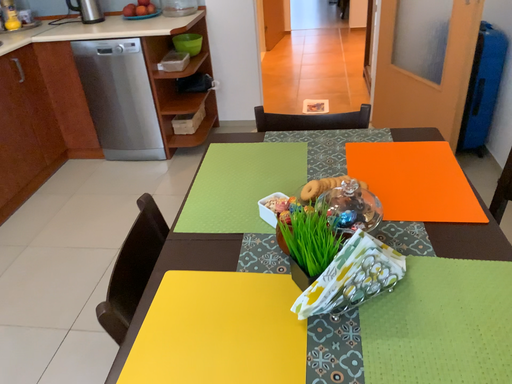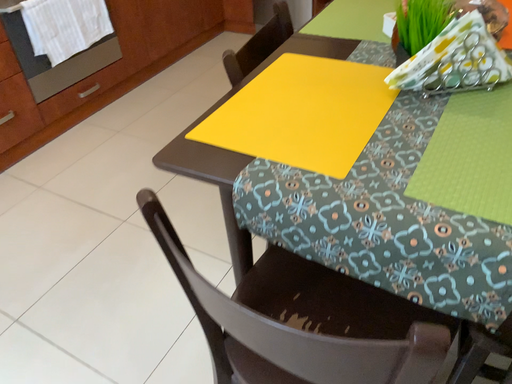
Question: How did the camera likely rotate when shooting the video?

Choices:
 (A) rotated downward
 (B) rotated upward

Answer: (A)